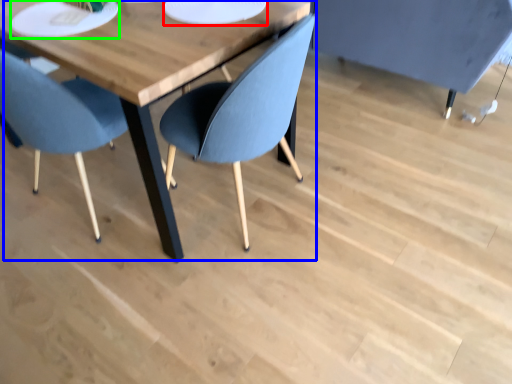
Question: Which object is positioned farthest from paper plate (highlighted by a red box)? Select from table (highlighted by a blue box) and platter (highlighted by a green box).

Choices:
 (A) table
 (B) platter

Answer: (B)